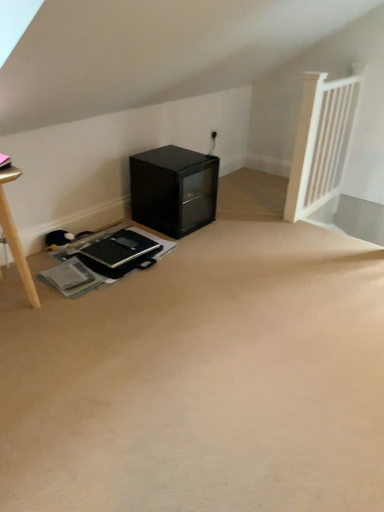
What do you see at coordinates (120, 248) in the screenshot?
I see `black matte laptop at center` at bounding box center [120, 248].

In order to click on black matte laptop at center in this screenshot , I will do `click(120, 248)`.

Where is `black glass cabinet at lower center`? The width and height of the screenshot is (384, 512). black glass cabinet at lower center is located at coordinates (173, 189).

What do you see at coordinates (173, 189) in the screenshot?
I see `black glass cabinet at lower center` at bounding box center [173, 189].

At what (x,y) coordinates should I click in order to perform the action: click on black matte laptop at center. Please return your answer as a coordinate pair (x, y). Looking at the image, I should click on (120, 248).

Would you say black matte laptop at center is to the left or to the right of black glass cabinet at lower center in the picture?

Based on their positions, black matte laptop at center is located to the left of black glass cabinet at lower center.

Is the position of black matte laptop at center more distant than that of black glass cabinet at lower center?

No, it is in front of black glass cabinet at lower center.

Consider the image. Which point is more distant from viewer, (91,256) or (146,183)?

Point (146,183)

From the image's perspective, relative to black glass cabinet at lower center, is black matte laptop at center above or below?

Based on their image positions, black matte laptop at center is located beneath black glass cabinet at lower center.

From a real-world perspective, which is physically above, black matte laptop at center or black glass cabinet at lower center?

black glass cabinet at lower center, from a real-world perspective.

Which object is wider, black matte laptop at center or black glass cabinet at lower center?

Wider between the two is black glass cabinet at lower center.

Can you confirm if black matte laptop at center is shorter than black glass cabinet at lower center?

Yes, black matte laptop at center is shorter than black glass cabinet at lower center.

Who is bigger, black matte laptop at center or black glass cabinet at lower center?

Bigger between the two is black glass cabinet at lower center.

In the scene shown: Is black glass cabinet at lower center surrounded by black matte laptop at center?

No, black glass cabinet at lower center is not a part of black matte laptop at center.

Is there a large distance between black matte laptop at center and black glass cabinet at lower center?

That's not correct — black matte laptop at center is a little close to black glass cabinet at lower center.

Is black matte laptop at center oriented towards black glass cabinet at lower center?

No.

Can you tell me how much black matte laptop at center and black glass cabinet at lower center differ in facing direction?

The angular difference between black matte laptop at center and black glass cabinet at lower center is 0.321 degrees.

I want to click on laptop in front of the black glass cabinet at lower center, so click(120, 248).

Based on their positions, is black glass cabinet at lower center located to the left or right of black matte laptop at center?

In the image, black glass cabinet at lower center appears on the right side of black matte laptop at center.

Which object is further away from the camera, black glass cabinet at lower center or black matte laptop at center?

black glass cabinet at lower center.

Considering the positions of point (198, 165) and point (123, 249), is point (198, 165) closer or farther from the camera than point (123, 249)?

Point (198, 165) is positioned farther from the camera compared to point (123, 249).

From the image's perspective, is black glass cabinet at lower center located above or below black matte laptop at center?

Clearly, from the image's perspective, black glass cabinet at lower center is above black matte laptop at center.

From the picture: From a real-world perspective, is black glass cabinet at lower center physically above black matte laptop at center?

Yes, from a real-world perspective, black glass cabinet at lower center is on top of black matte laptop at center.

Based on the photo, considering the sizes of objects black glass cabinet at lower center and black matte laptop at center in the image provided, who is thinner, black glass cabinet at lower center or black matte laptop at center?

With smaller width is black matte laptop at center.

Who is shorter, black glass cabinet at lower center or black matte laptop at center?

With less height is black matte laptop at center.

Considering the sizes of black glass cabinet at lower center and black matte laptop at center in the image, is black glass cabinet at lower center bigger or smaller than black matte laptop at center?

black glass cabinet at lower center is bigger than black matte laptop at center.

Is black glass cabinet at lower center not inside black matte laptop at center?

Yes, black glass cabinet at lower center is outside of black matte laptop at center.

Are black glass cabinet at lower center and black matte laptop at center beside each other?

No.

Is black glass cabinet at lower center facing towards black matte laptop at center?

No, black glass cabinet at lower center is not facing towards black matte laptop at center.

I want to click on furniture above the black matte laptop at center (from the image's perspective), so click(173, 189).

Where is `laptop located on the left of black glass cabinet at lower center`? Image resolution: width=384 pixels, height=512 pixels. laptop located on the left of black glass cabinet at lower center is located at coordinates (120, 248).

This screenshot has height=512, width=384. Find the location of `laptop in front of the black glass cabinet at lower center`. laptop in front of the black glass cabinet at lower center is located at coordinates (120, 248).